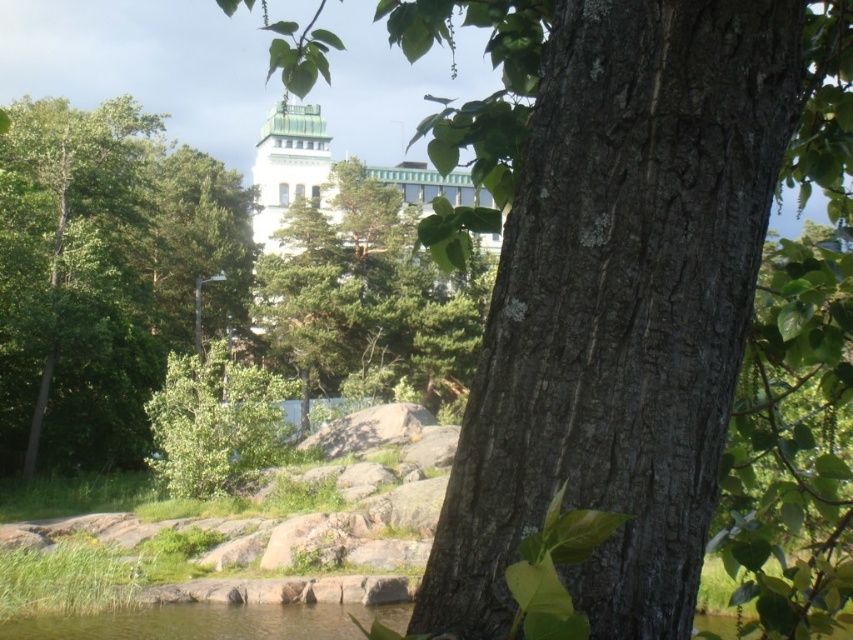
Question: Which point is closer to the camera?

Choices:
 (A) (608, 186)
 (B) (268, 442)

Answer: (A)

Question: Is smooth bark tree trunk at center thinner than green leafy tree at lower left?

Choices:
 (A) no
 (B) yes

Answer: (B)

Question: Which object is closer to the camera taking this photo?

Choices:
 (A) smooth bark tree trunk at center
 (B) green leafy tree at lower left

Answer: (A)

Question: Is smooth bark tree trunk at center positioned in front of green leafy tree at lower left?

Choices:
 (A) yes
 (B) no

Answer: (A)

Question: Is smooth bark tree trunk at center to the left of green leafy tree at lower left from the viewer's perspective?

Choices:
 (A) yes
 (B) no

Answer: (B)